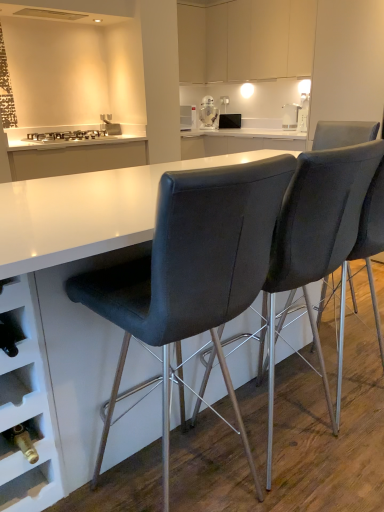
Locate an element on the screen. This screenshot has width=384, height=512. matte black microwave at center, the 2th appliance from the left is located at coordinates (230, 121).

The width and height of the screenshot is (384, 512). Describe the element at coordinates (259, 39) in the screenshot. I see `matte white cabinets at upper center` at that location.

The image size is (384, 512). What do you see at coordinates (192, 271) in the screenshot?
I see `black leather chair at center, which appears as the 2th chair when viewed from the right` at bounding box center [192, 271].

Identify the location of matte black chair at center, arranged as the 2th chair when viewed from the left. This screenshot has width=384, height=512. (373, 238).

Describe the element at coordinates (373, 238) in the screenshot. The width and height of the screenshot is (384, 512). I see `matte black chair at center, which is counted as the first chair, starting from the right` at that location.

The width and height of the screenshot is (384, 512). Describe the element at coordinates (290, 116) in the screenshot. I see `white glossy toaster at upper right` at that location.

The height and width of the screenshot is (512, 384). I want to click on matte black microwave at center, the 2th appliance from the left, so click(x=230, y=121).

Where is `appliance on the right of white glossy r2-d2 droid at upper center, which ranks as the 1th appliance in left-to-right order`? appliance on the right of white glossy r2-d2 droid at upper center, which ranks as the 1th appliance in left-to-right order is located at coordinates (230, 121).

Between matte black microwave at center, the first appliance when ordered from right to left, and white glossy r2-d2 droid at upper center, which ranks as the 1th appliance in left-to-right order, which one has more height?

white glossy r2-d2 droid at upper center, which ranks as the 1th appliance in left-to-right order.

What's the angular difference between matte black microwave at center, the first appliance when ordered from right to left, and white glossy r2-d2 droid at upper center, which is the second appliance from right to left,'s facing directions?

There is a 16.9-degree angle between the facing directions of matte black microwave at center, the first appliance when ordered from right to left, and white glossy r2-d2 droid at upper center, which is the second appliance from right to left.

Would you say matte black microwave at center, the 2th appliance from the left, is outside white glossy r2-d2 droid at upper center, which is the second appliance from right to left?

Yes, matte black microwave at center, the 2th appliance from the left, is outside of white glossy r2-d2 droid at upper center, which is the second appliance from right to left.

How far apart are white glossy r2-d2 droid at upper center, which is the second appliance from right to left, and black leather chair at center, the 1th chair from the left?

12.79 feet.

Is point (205, 96) positioned before point (103, 281)?

No.

Can you confirm if white glossy r2-d2 droid at upper center, which is the second appliance from right to left, is positioned to the right of black leather chair at center, which appears as the 2th chair when viewed from the right?

Correct, you'll find white glossy r2-d2 droid at upper center, which is the second appliance from right to left, to the right of black leather chair at center, which appears as the 2th chair when viewed from the right.

What's the angular difference between white glossy r2-d2 droid at upper center, which ranks as the 1th appliance in left-to-right order, and black leather chair at center, the 1th chair from the left,'s facing directions?

The angle between the facing direction of white glossy r2-d2 droid at upper center, which ranks as the 1th appliance in left-to-right order, and the facing direction of black leather chair at center, the 1th chair from the left, is 149 degrees.

Could white glossy stove at upper left be considered to be inside matte white cabinets at upper center?

No.

From the image's perspective, which one is positioned higher, matte white cabinets at upper center or white glossy stove at upper left?

matte white cabinets at upper center.

Does matte white cabinets at upper center turn towards white glossy stove at upper left?

Yes, matte white cabinets at upper center is facing white glossy stove at upper left.

How far apart are matte white cabinets at upper center and white glossy stove at upper left?

matte white cabinets at upper center is 5.23 feet away from white glossy stove at upper left.

Based on the photo, does matte white cabinets at upper center have a lesser height compared to black leather chair at center, the 1th chair from the left?

Indeed, matte white cabinets at upper center has a lesser height compared to black leather chair at center, the 1th chair from the left.

From the image's perspective, which one is positioned lower, matte white cabinets at upper center or black leather chair at center, which appears as the 2th chair when viewed from the right?

From the image's view, black leather chair at center, which appears as the 2th chair when viewed from the right, is below.

Considering the points (218, 28) and (272, 223), which point is in front, point (218, 28) or point (272, 223)?

Point (272, 223)

Who is smaller, matte white cabinets at upper center or black leather chair at center, which appears as the 2th chair when viewed from the right?

Smaller between the two is black leather chair at center, which appears as the 2th chair when viewed from the right.

From the image's perspective, is matte black chair at center, which is counted as the first chair, starting from the right, beneath matte black microwave at center, the 2th appliance from the left?

Correct, matte black chair at center, which is counted as the first chair, starting from the right, appears lower than matte black microwave at center, the 2th appliance from the left, in the image.

In the scene shown: Considering the sizes of objects matte black chair at center, which is counted as the first chair, starting from the right, and matte black microwave at center, the first appliance when ordered from right to left, in the image provided, who is bigger, matte black chair at center, which is counted as the first chair, starting from the right, or matte black microwave at center, the first appliance when ordered from right to left,?

matte black chair at center, which is counted as the first chair, starting from the right, is bigger.

Based on the photo, is matte black chair at center, which is counted as the first chair, starting from the right, taller than matte black microwave at center, the first appliance when ordered from right to left?

Indeed, matte black chair at center, which is counted as the first chair, starting from the right, has a greater height compared to matte black microwave at center, the first appliance when ordered from right to left.

Does matte black chair at center, arranged as the 2th chair when viewed from the left, contain matte black microwave at center, the first appliance when ordered from right to left?

No, matte black chair at center, arranged as the 2th chair when viewed from the left, does not contain matte black microwave at center, the first appliance when ordered from right to left.

Between white glossy stove at upper left and matte black chair at center, arranged as the 2th chair when viewed from the left, which one is positioned in front?

matte black chair at center, arranged as the 2th chair when viewed from the left, is in front.

Is point (95, 138) closer or farther from the camera than point (320, 355)?

Point (95, 138) is farther from the camera than point (320, 355).

Which object is positioned more to the right, white glossy stove at upper left or matte black chair at center, which is counted as the first chair, starting from the right?

matte black chair at center, which is counted as the first chair, starting from the right, is more to the right.

From the image's perspective, who appears lower, white glossy stove at upper left or matte black chair at center, which is counted as the first chair, starting from the right?

matte black chair at center, which is counted as the first chair, starting from the right, is shown below in the image.

Considering the relative sizes of white glossy stove at upper left and black leather chair at center, the 1th chair from the left, in the image provided, is white glossy stove at upper left taller than black leather chair at center, the 1th chair from the left,?

Incorrect, the height of white glossy stove at upper left is not larger of that of black leather chair at center, the 1th chair from the left.

Considering the positions of objects white glossy stove at upper left and black leather chair at center, which appears as the 2th chair when viewed from the right, in the image provided, who is in front, white glossy stove at upper left or black leather chair at center, which appears as the 2th chair when viewed from the right,?

black leather chair at center, which appears as the 2th chair when viewed from the right, is in front.

The width and height of the screenshot is (384, 512). I want to click on home appliance lying above the black leather chair at center, the 1th chair from the left (from the image's perspective), so tap(67, 135).

How different are the orientations of white glossy stove at upper left and black leather chair at center, the 1th chair from the left, in degrees?

The angular difference between white glossy stove at upper left and black leather chair at center, the 1th chair from the left, is 178 degrees.

Find the location of a particular element. The width and height of the screenshot is (384, 512). appliance in front of the white glossy r2-d2 droid at upper center, which ranks as the 1th appliance in left-to-right order is located at coordinates (230, 121).

The image size is (384, 512). Find the location of `the 2nd chair below when counting from the white glossy r2-d2 droid at upper center, which ranks as the 1th appliance in left-to-right order (from the image's perspective)`. the 2nd chair below when counting from the white glossy r2-d2 droid at upper center, which ranks as the 1th appliance in left-to-right order (from the image's perspective) is located at coordinates (192, 271).

Considering their positions, is matte black chair at center, which is counted as the first chair, starting from the right, positioned further to white glossy r2-d2 droid at upper center, which ranks as the 1th appliance in left-to-right order, than black leather chair at center, which appears as the 2th chair when viewed from the right?

black leather chair at center, which appears as the 2th chair when viewed from the right, lies further to white glossy r2-d2 droid at upper center, which ranks as the 1th appliance in left-to-right order, than the other object.

Looking at this image, based on their spatial positions, is matte black chair at center, which is counted as the first chair, starting from the right, or black leather chair at center, the 1th chair from the left, closer to white glossy stove at upper left?

matte black chair at center, which is counted as the first chair, starting from the right, is positioned closer to the anchor white glossy stove at upper left.

Consider the image. From the image, which object appears to be farther from white glossy toaster at upper right, matte black chair at center, which is counted as the first chair, starting from the right, or black leather chair at center, the 1th chair from the left?

black leather chair at center, the 1th chair from the left, lies further to white glossy toaster at upper right than the other object.

Looking at the image, which one is located further to matte black chair at center, arranged as the 2th chair when viewed from the left, white glossy toaster at upper right or white glossy stove at upper left?

white glossy stove at upper left is further to matte black chair at center, arranged as the 2th chair when viewed from the left.

When comparing their distances from white glossy toaster at upper right, does matte black microwave at center, the first appliance when ordered from right to left, or black leather chair at center, the 1th chair from the left, seem closer?

matte black microwave at center, the first appliance when ordered from right to left, is positioned closer to the anchor white glossy toaster at upper right.

Based on their spatial positions, is matte white cabinets at upper center or black leather chair at center, the 1th chair from the left, closer to white glossy r2-d2 droid at upper center, which is the second appliance from right to left?

matte white cabinets at upper center is closer to white glossy r2-d2 droid at upper center, which is the second appliance from right to left.

Which object lies nearer to the anchor point matte black chair at center, which is counted as the first chair, starting from the right, white glossy r2-d2 droid at upper center, which is the second appliance from right to left, or white glossy stove at upper left?

Based on the image, white glossy stove at upper left appears to be nearer to matte black chair at center, which is counted as the first chair, starting from the right.

In the scene shown: Based on their spatial positions, is black leather chair at center, which appears as the 2th chair when viewed from the right, or white glossy toaster at upper right closer to matte white cabinets at upper center?

white glossy toaster at upper right is positioned closer to the anchor matte white cabinets at upper center.

Find the location of a particular element. The height and width of the screenshot is (512, 384). chair positioned between black leather chair at center, the 1th chair from the left, and white glossy stove at upper left from near to far is located at coordinates (373, 238).

Where is `kitchen appliance between matte black chair at center, which is counted as the first chair, starting from the right, and matte black microwave at center, the first appliance when ordered from right to left, in the front-back direction`? This screenshot has height=512, width=384. kitchen appliance between matte black chair at center, which is counted as the first chair, starting from the right, and matte black microwave at center, the first appliance when ordered from right to left, in the front-back direction is located at coordinates (290, 116).

Locate an element on the screen. The image size is (384, 512). home appliance between black leather chair at center, the 1th chair from the left, and matte black microwave at center, the first appliance when ordered from right to left, from front to back is located at coordinates (67, 135).

Find the location of `appliance located between black leather chair at center, which appears as the 2th chair when viewed from the right, and white glossy r2-d2 droid at upper center, which ranks as the 1th appliance in left-to-right order, in the depth direction`. appliance located between black leather chair at center, which appears as the 2th chair when viewed from the right, and white glossy r2-d2 droid at upper center, which ranks as the 1th appliance in left-to-right order, in the depth direction is located at coordinates (230, 121).